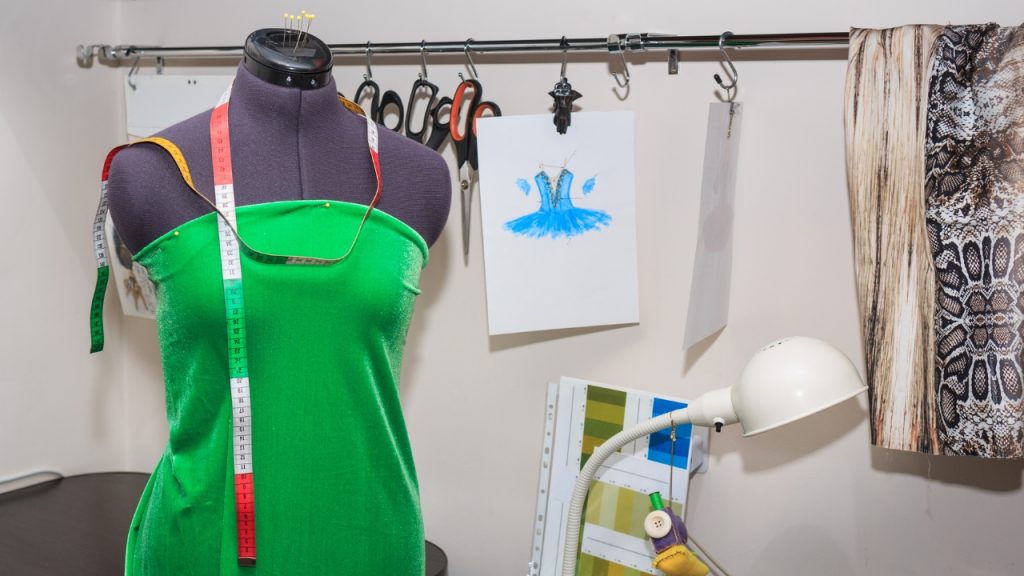
The width and height of the screenshot is (1024, 576). In order to click on bust in this screenshot , I will do `click(253, 280)`.